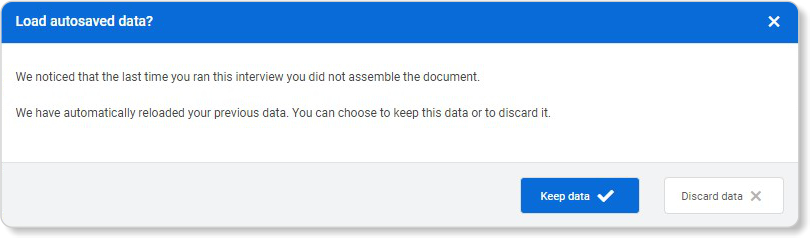
At what (x,y) coordinates should I click in order to perform the action: click on window (superimposed). Please return your answer as a coordinate pair (x, y). This screenshot has width=810, height=238. Looking at the image, I should click on point(589,13).